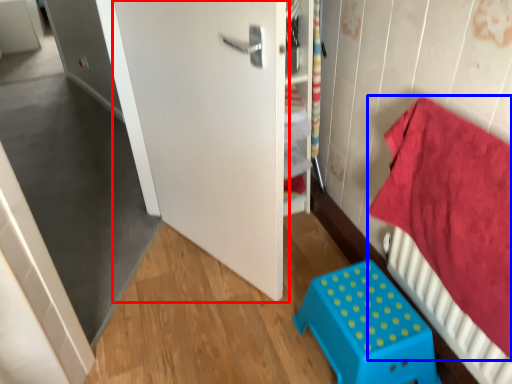
Question: Which object is further to the camera taking this photo, door (highlighted by a red box) or bedding (highlighted by a blue box)?

Choices:
 (A) door
 (B) bedding

Answer: (A)